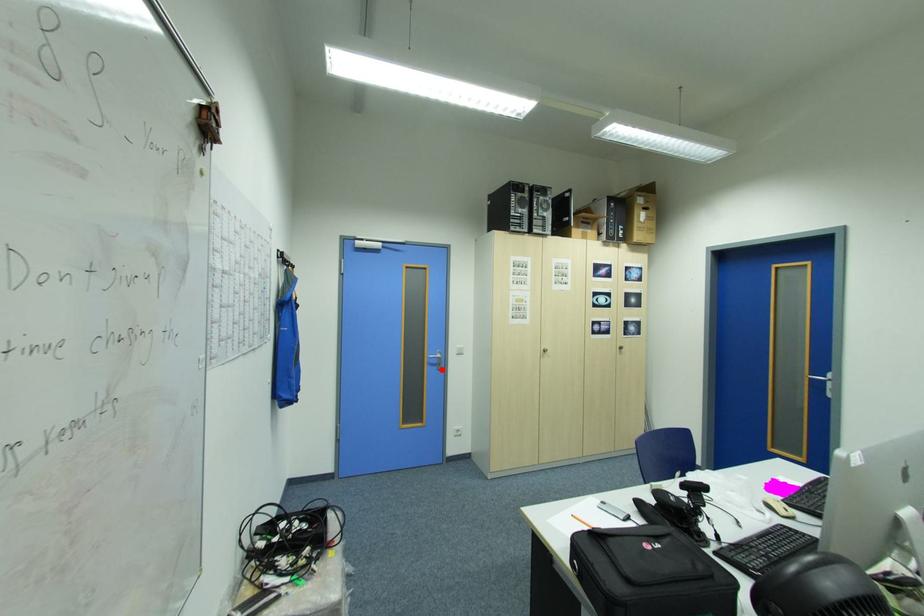
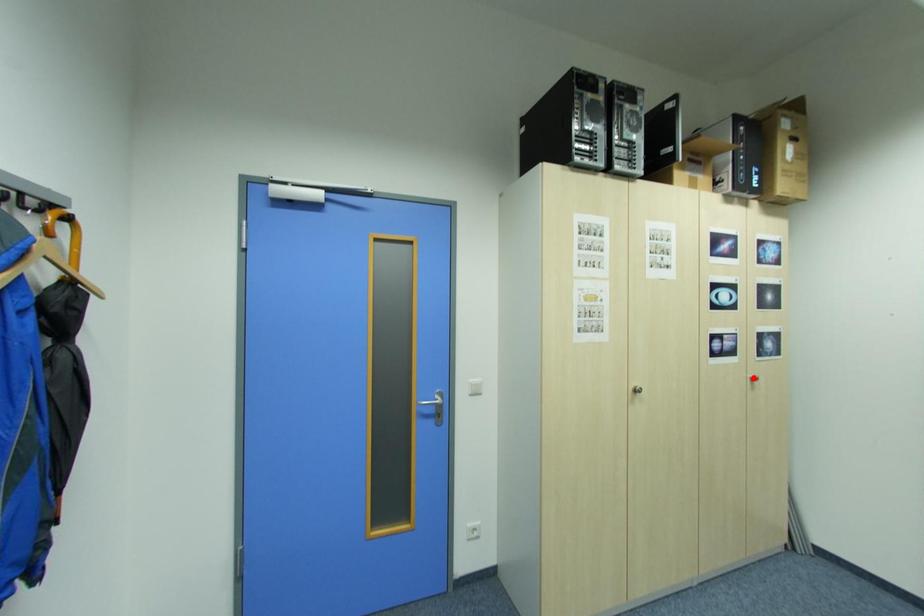
I am providing you with two images of the same scene from different viewpoints. A red point is marked on the first image and another point is marked on the second image. Does the point marked in image1 correspond to the same location as the one in image2?

No